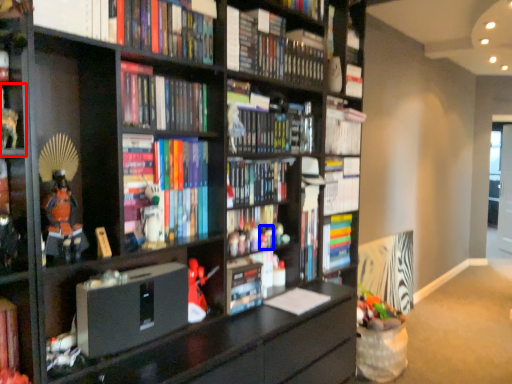
Question: Which object is closer to the camera taking this photo, shelf (highlighted by a red box) or toy (highlighted by a blue box)?

Choices:
 (A) shelf
 (B) toy

Answer: (A)